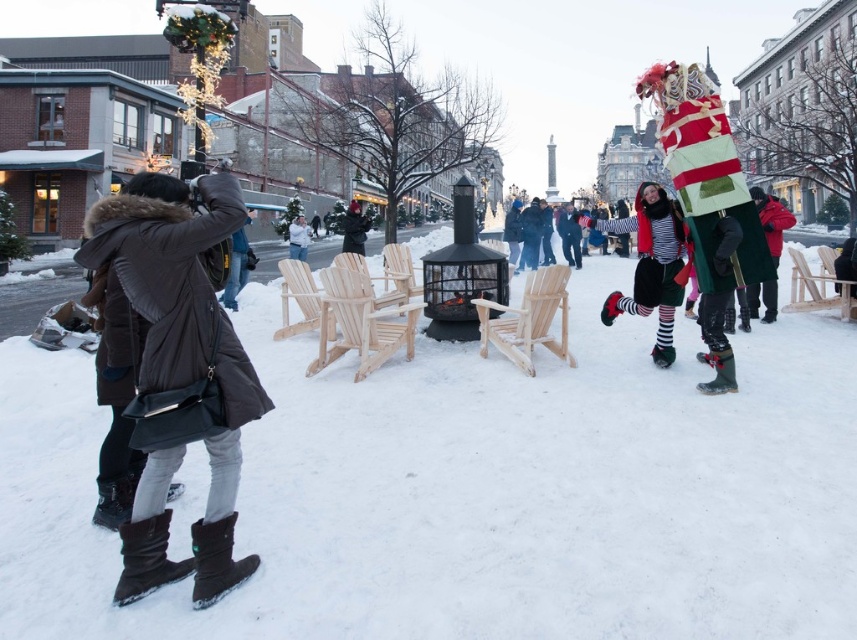
You are organizing a small gathering in the square and need to place a table between the light brown wood chairs at center and the white cotton snowman at center. Which object should the table be closer to if it needs to be near the smaller one?

The table should be placed closer to the light brown wood chairs at center since they are smaller compared to the white cotton snowman at center.